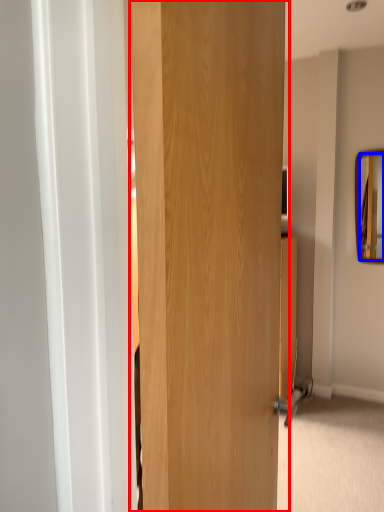
Question: Which of the following is the closest to the observer, door (highlighted by a red box) or mirror (highlighted by a blue box)?

Choices:
 (A) door
 (B) mirror

Answer: (A)